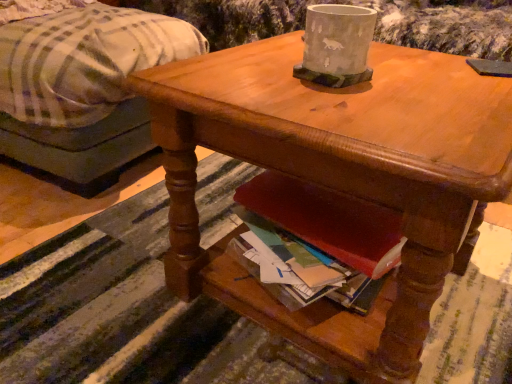
Question: Based on their sizes in the image, would you say wooden desk at center is bigger or smaller than gray concrete pot at upper center?

Choices:
 (A) big
 (B) small

Answer: (A)

Question: From their relative heights in the image, would you say wooden desk at center is taller or shorter than gray concrete pot at upper center?

Choices:
 (A) short
 (B) tall

Answer: (B)

Question: Which object is the closest to the wooden desk at center?

Choices:
 (A) gray concrete pot at upper center
 (B) plaid fabric ottoman at left

Answer: (A)

Question: Which of these objects is positioned farthest from the plaid fabric ottoman at left?

Choices:
 (A) gray concrete pot at upper center
 (B) wooden desk at center

Answer: (A)